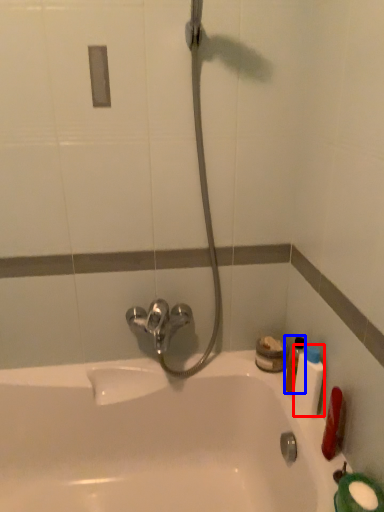
Question: Which object is closer to the camera taking this photo, mouthwash (highlighted by a red box) or mouthwash (highlighted by a blue box)?

Choices:
 (A) mouthwash
 (B) mouthwash

Answer: (A)